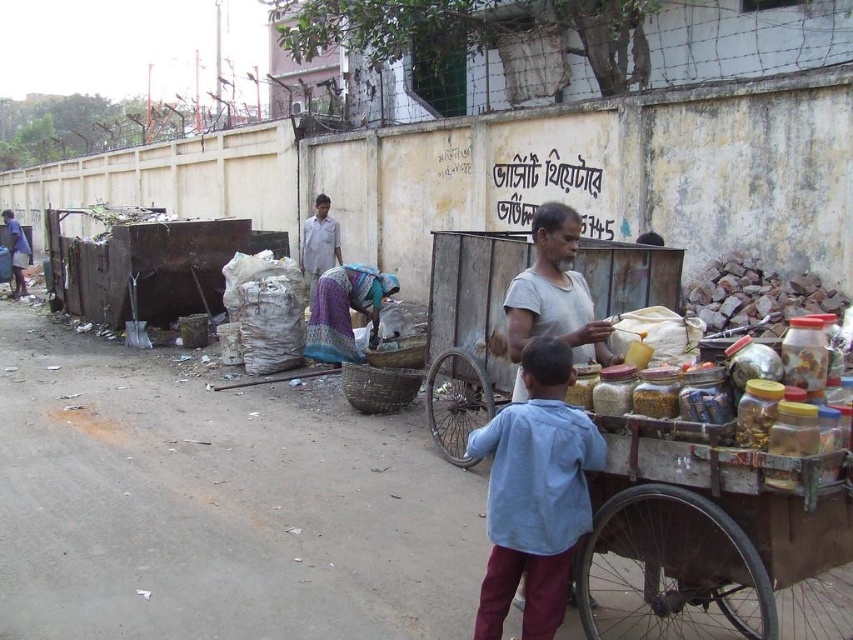
Question: Is printed fabric basket at center positioned in front of light gray shirt at center?

Choices:
 (A) no
 (B) yes

Answer: (B)

Question: Which of the following is the farthest from the observer?

Choices:
 (A) (584, 330)
 (B) (811, 621)

Answer: (A)

Question: Can you confirm if printed fabric basket at center is smaller than light gray shirt at center?

Choices:
 (A) no
 (B) yes

Answer: (B)

Question: Estimate the real-world distances between objects in this image. Which object is farther from the printed fabric basket at center?

Choices:
 (A) light gray shirt at center
 (B) light blue fabric shirt at center
 (C) wooden cart at center

Answer: (B)

Question: Based on their relative distances, which object is farther from the gray cotton shirt at center?

Choices:
 (A) light blue fabric shirt at center
 (B) wooden cart at center
 (C) printed fabric basket at center
 (D) light gray shirt at center

Answer: (D)

Question: Does light blue fabric shirt at center have a smaller size compared to printed fabric basket at center?

Choices:
 (A) no
 (B) yes

Answer: (B)